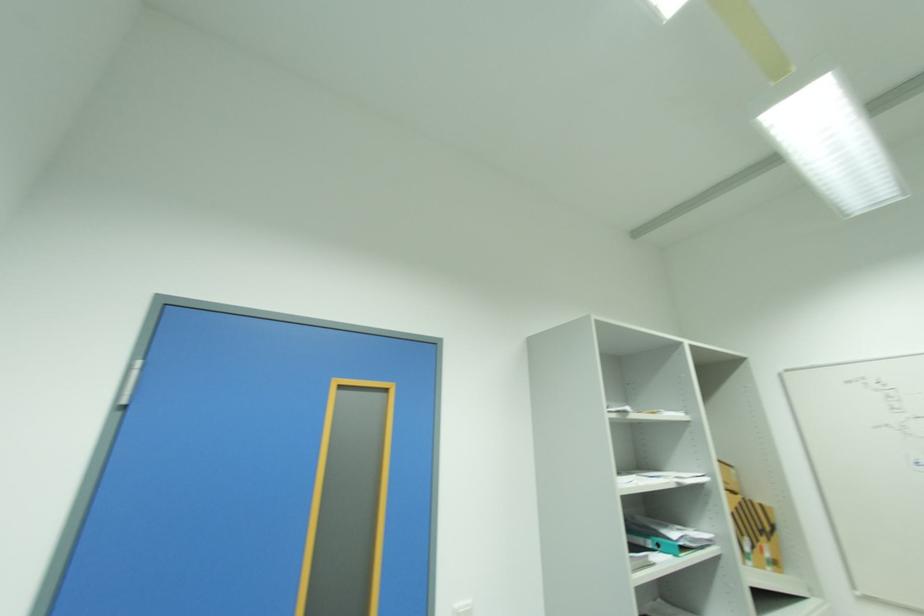
Find the location of a particular element. cardboard box is located at coordinates (751, 524).